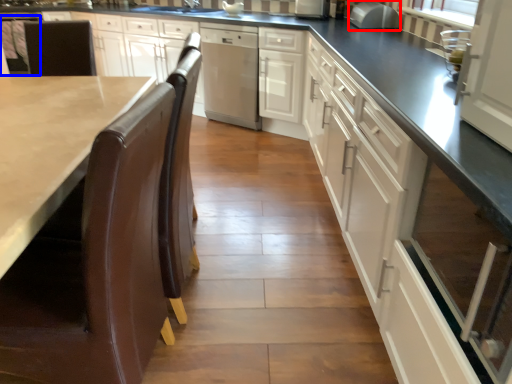
Question: Which of the following is the farthest to the observer, appliance (highlighted by a red box) or chair (highlighted by a blue box)?

Choices:
 (A) appliance
 (B) chair

Answer: (B)